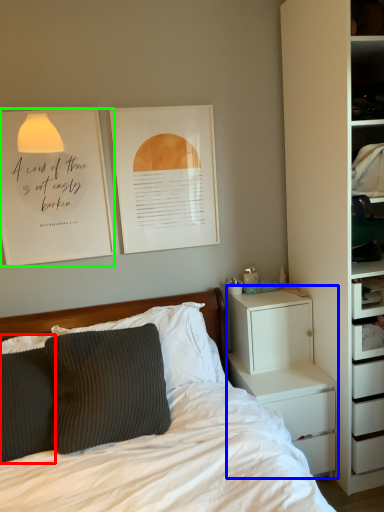
Question: Estimate the real-world distances between objects in this image. Which object is farther from pillow (highlighted by a red box), chest of drawers (highlighted by a blue box) or bulletin board (highlighted by a green box)?

Choices:
 (A) chest of drawers
 (B) bulletin board

Answer: (A)